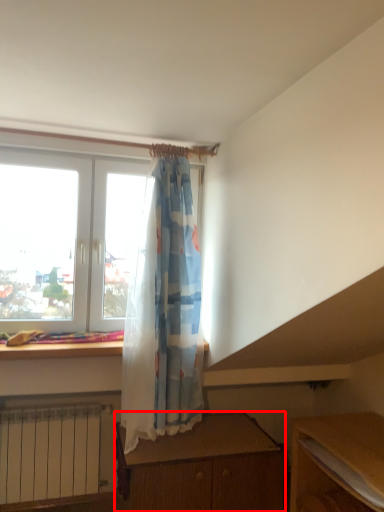
Question: From the image, what is the correct spatial relationship of desk (annotated by the red box) in relation to table?

Choices:
 (A) left
 (B) right

Answer: (A)